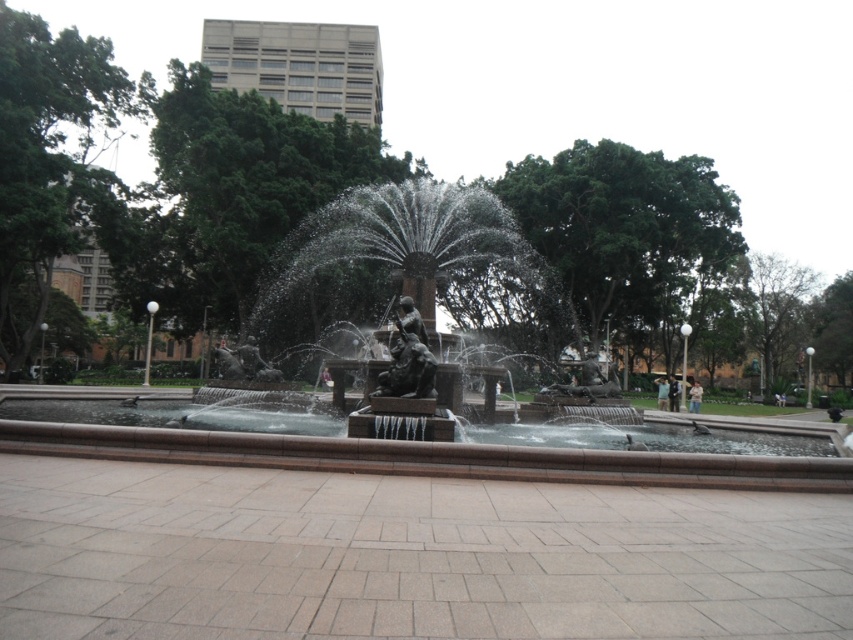
Question: Among these points, which one is nearest to the camera?

Choices:
 (A) (409, 316)
 (B) (172, 456)

Answer: (B)

Question: Is bronze statue fountain at center to the right of bronze statue at center from the viewer's perspective?

Choices:
 (A) yes
 (B) no

Answer: (B)

Question: Which of the following is the closest to the observer?

Choices:
 (A) (697, 468)
 (B) (422, 324)

Answer: (A)

Question: Where is bronze statue fountain at center located in relation to bronze statue at center in the image?

Choices:
 (A) below
 (B) above

Answer: (A)

Question: Can you confirm if bronze statue fountain at center is thinner than bronze statue at center?

Choices:
 (A) yes
 (B) no

Answer: (B)